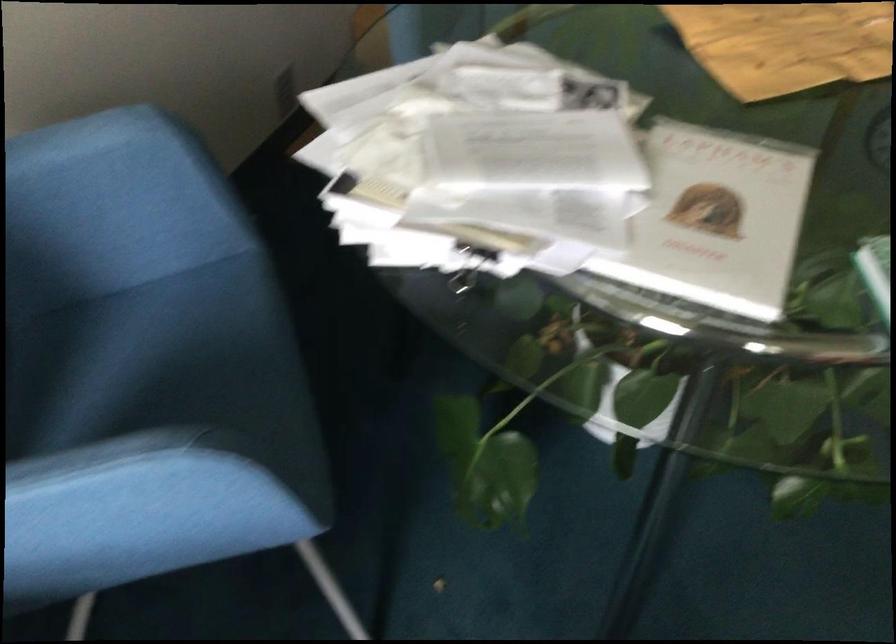
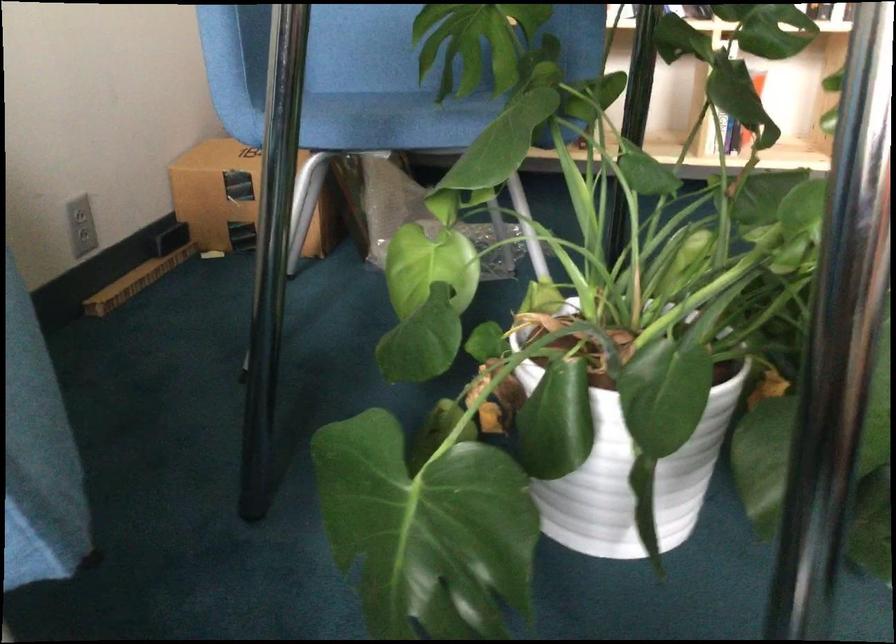
Question: The images are taken continuously from a first-person perspective. In which direction are you moving?

Choices:
 (A) Left
 (B) Right
 (C) Forward
 (D) Backward

Answer: (C)